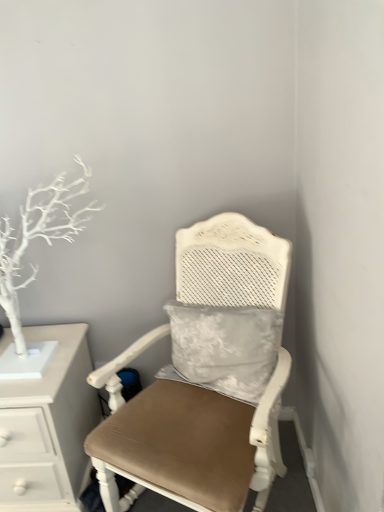
Find the location of a particular element. matte white chair at center is located at coordinates (186, 439).

The image size is (384, 512). What do you see at coordinates (40, 236) in the screenshot?
I see `white matte tree at left` at bounding box center [40, 236].

Identify the location of white painted wood chest of drawers at left. The image size is (384, 512). pyautogui.click(x=48, y=425).

Identify the location of matte white chair at center. The height and width of the screenshot is (512, 384). (186, 439).

Based on the photo, is matte white chair at center smaller than white painted wood chest of drawers at left?

Actually, matte white chair at center might be larger than white painted wood chest of drawers at left.

Is the depth of matte white chair at center greater than that of white painted wood chest of drawers at left?

No, matte white chair at center is closer to the camera.

From a real-world perspective, is matte white chair at center above or below white painted wood chest of drawers at left?

Clearly, from a real-world perspective, matte white chair at center is above white painted wood chest of drawers at left.

Does white painted wood chest of drawers at left have a larger size compared to white matte tree at left?

Yes.

From the image's perspective, is white painted wood chest of drawers at left on white matte tree at left?

No.

In terms of width, does white painted wood chest of drawers at left look wider or thinner when compared to white matte tree at left?

Considering their sizes, white painted wood chest of drawers at left looks broader than white matte tree at left.

Identify the location of tree in front of the white painted wood chest of drawers at left. (40, 236).

From the image's perspective, who appears lower, white matte tree at left or white painted wood chest of drawers at left?

white painted wood chest of drawers at left, from the image's perspective.

The width and height of the screenshot is (384, 512). There is a white painted wood chest of drawers at left. Find the location of `tree above it (from a real-world perspective)`. tree above it (from a real-world perspective) is located at coordinates (40, 236).

In terms of height, does white matte tree at left look taller or shorter compared to white painted wood chest of drawers at left?

white matte tree at left is taller than white painted wood chest of drawers at left.

Does white matte tree at left have a lesser width compared to white painted wood chest of drawers at left?

Indeed, white matte tree at left has a lesser width compared to white painted wood chest of drawers at left.

Does white matte tree at left appear on the left side of matte white chair at center?

Yes, white matte tree at left is to the left of matte white chair at center.

From the image's perspective, does white matte tree at left appear lower than matte white chair at center?

Actually, white matte tree at left appears above matte white chair at center in the image.

In the image, is white matte tree at left positioned in front of or behind matte white chair at center?

In the image, white matte tree at left appears behind matte white chair at center.

Is white painted wood chest of drawers at left touching matte white chair at center?

No, white painted wood chest of drawers at left is not beside matte white chair at center.

Would you say white painted wood chest of drawers at left contains matte white chair at center?

No, matte white chair at center is located outside of white painted wood chest of drawers at left.

Is white painted wood chest of drawers at left thinner than matte white chair at center?

Indeed, white painted wood chest of drawers at left has a lesser width compared to matte white chair at center.

How many degrees apart are the facing directions of white painted wood chest of drawers at left and matte white chair at center?

The angular difference between white painted wood chest of drawers at left and matte white chair at center is 27.8 degrees.

Is matte white chair at center outside of white matte tree at left?

Indeed, matte white chair at center is completely outside white matte tree at left.

Identify the location of tree that appears above the matte white chair at center (from the image's perspective). The image size is (384, 512). (40, 236).

Is matte white chair at center shorter than white matte tree at left?

No.

The width and height of the screenshot is (384, 512). Find the location of `chest of drawers below the matte white chair at center (from the image's perspective)`. chest of drawers below the matte white chair at center (from the image's perspective) is located at coordinates (48, 425).

Locate an element on the screen. This screenshot has width=384, height=512. tree on the right side of white painted wood chest of drawers at left is located at coordinates (40, 236).

When comparing their distances from matte white chair at center, does white painted wood chest of drawers at left or white matte tree at left seem further?

white matte tree at left lies further to matte white chair at center than the other object.

When comparing their distances from white matte tree at left, does white painted wood chest of drawers at left or matte white chair at center seem further?

The object further to white matte tree at left is matte white chair at center.

Which object lies nearer to the anchor point white painted wood chest of drawers at left, white matte tree at left or matte white chair at center?

white matte tree at left is closer to white painted wood chest of drawers at left.

Estimate the real-world distances between objects in this image. Which object is further from matte white chair at center, white matte tree at left or white painted wood chest of drawers at left?

white matte tree at left is further to matte white chair at center.

Which object lies nearer to the anchor point white matte tree at left, matte white chair at center or white painted wood chest of drawers at left?

white painted wood chest of drawers at left is closer to white matte tree at left.

Looking at the image, which one is located further to white painted wood chest of drawers at left, matte white chair at center or white matte tree at left?

matte white chair at center is further to white painted wood chest of drawers at left.

Image resolution: width=384 pixels, height=512 pixels. I want to click on tree situated between white painted wood chest of drawers at left and matte white chair at center from left to right, so click(x=40, y=236).